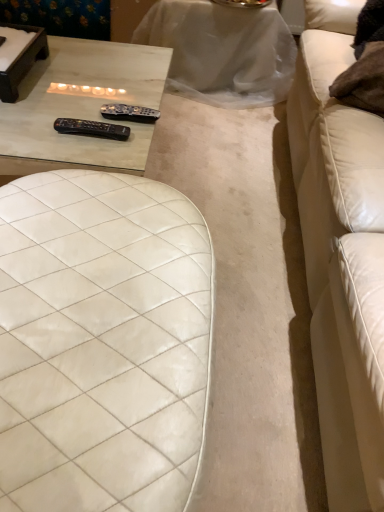
You are a GUI agent. You are given a task and a screenshot of the screen. Output one action in this format:
    pyautogui.click(x=<x>, y=<y>)
    Task: Click on the free space to the left of black plastic remote at center, positioned as the 1th remote in front-to-back order
    
    Given the screenshot: What is the action you would take?
    pyautogui.click(x=38, y=128)